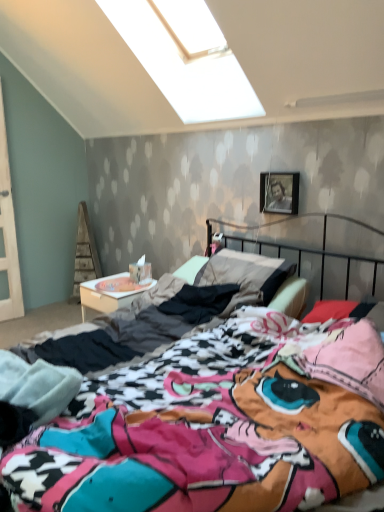
Question: Considering the positions of metallic silver picture frame at upper right and white cardboard at lower left in the image, is metallic silver picture frame at upper right taller or shorter than white cardboard at lower left?

Choices:
 (A) tall
 (B) short

Answer: (B)

Question: Looking at the image, does metallic silver picture frame at upper right seem bigger or smaller compared to white cardboard at lower left?

Choices:
 (A) big
 (B) small

Answer: (B)

Question: Based on their relative distances, which object is farther from the white cardboard at lower left?

Choices:
 (A) metallic silver picture frame at upper right
 (B) multicolored fabric bed at center

Answer: (B)

Question: Considering the real-world distances, which object is closest to the metallic silver picture frame at upper right?

Choices:
 (A) multicolored fabric bed at center
 (B) white cardboard at lower left

Answer: (B)